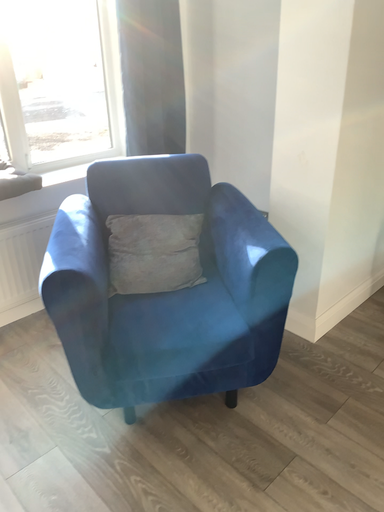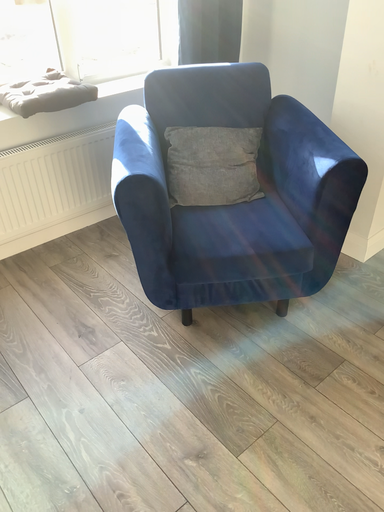
Question: How did the camera likely rotate when shooting the video?

Choices:
 (A) rotated downward
 (B) rotated upward

Answer: (A)